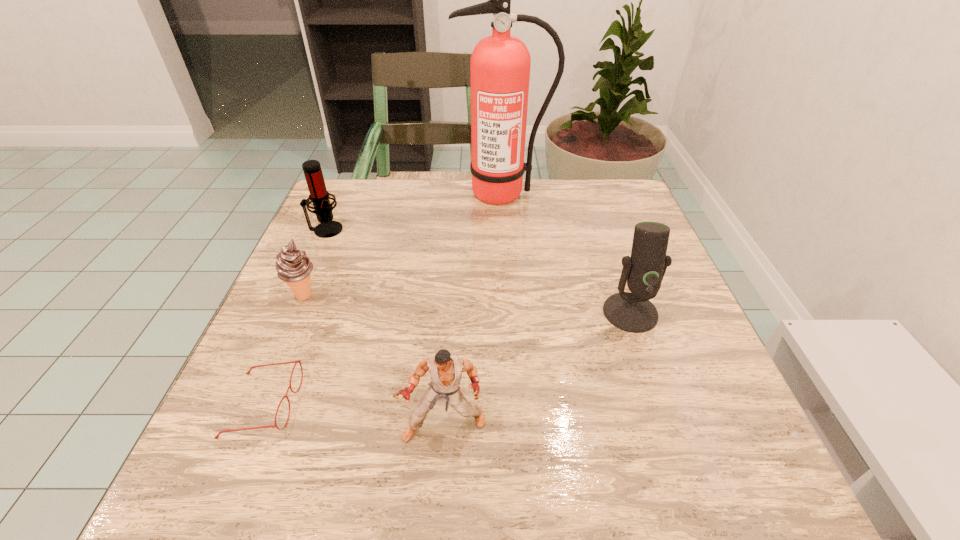
The image size is (960, 540). Find the location of `vacant space located on the left of the right microphone`. vacant space located on the left of the right microphone is located at coordinates (422, 313).

The height and width of the screenshot is (540, 960). What are the coordinates of `free spot located 0.240m on the front of the second farthest object` in the screenshot? It's located at (290, 310).

At what (x,y) coordinates should I click in order to perform the action: click on vacant space located 0.060m on the front-facing side of the puncher. Please return your answer as a coordinate pair (x, y). Looking at the image, I should click on (441, 488).

You are a GUI agent. You are given a task and a screenshot of the screen. Output one action in this format:
    pyautogui.click(x=<x>, y=<y>)
    Task: Click on the free space located on the right of the fifth tallest object
    This screenshot has width=960, height=540.
    Given the screenshot: What is the action you would take?
    pyautogui.click(x=398, y=295)

At what (x,y) coordinates should I click in order to perform the action: click on vacant space situated 0.120m on the face of the shortest object. Please return your answer as a coordinate pair (x, y). Looking at the image, I should click on (368, 404).

The height and width of the screenshot is (540, 960). I want to click on fire extinguisher present at the far edge, so click(x=500, y=64).

I want to click on microphone present at the far edge, so click(319, 196).

At what (x,y) coordinates should I click in order to perform the action: click on object that is positioned at the near edge. Please return your answer as a coordinate pair (x, y). This screenshot has width=960, height=540. Looking at the image, I should click on (446, 371).

Locate an element on the screen. This screenshot has height=540, width=960. microphone that is positioned at the left edge is located at coordinates (319, 196).

Identify the location of icecream situated at the left edge. Image resolution: width=960 pixels, height=540 pixels. (293, 266).